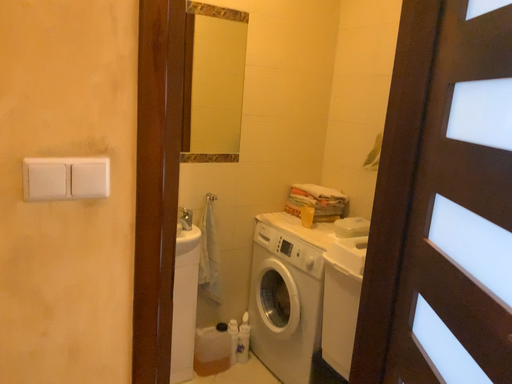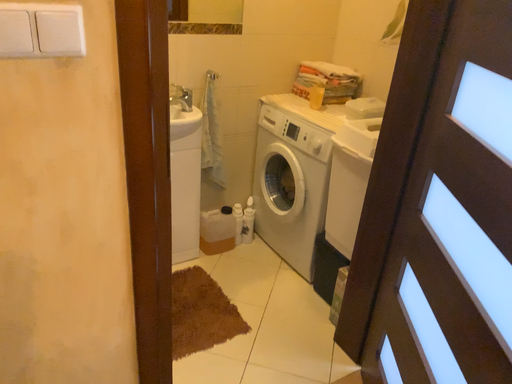
Question: Which way did the camera rotate in the video?

Choices:
 (A) rotated upward
 (B) rotated downward

Answer: (B)